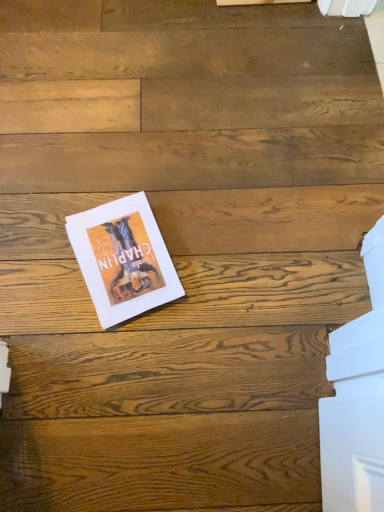
Where is `vacant space behind white paper book at center`? The image size is (384, 512). vacant space behind white paper book at center is located at coordinates (125, 165).